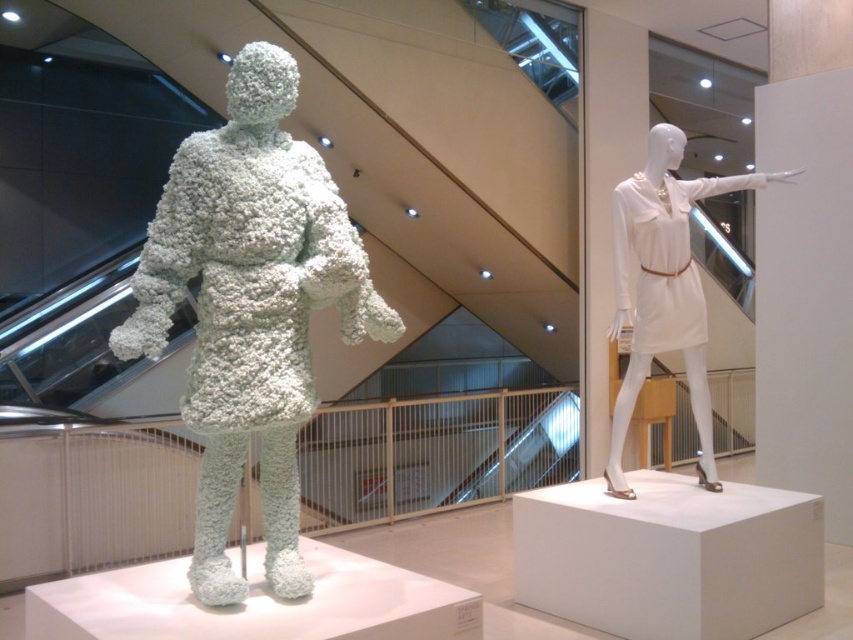
Is point (639, 358) closer to camera compared to point (508, 442)?

That is True.

Does white matte dress at right have a lesser width compared to metallic silver escalator at center?

Yes.

Is point (656, 273) positioned before point (461, 484)?

Yes, point (656, 273) is closer to viewer.

Locate an element on the screen. The height and width of the screenshot is (640, 853). white matte dress at right is located at coordinates (663, 288).

Does white fluffy sculpture at left have a smaller size compared to metallic silver escalator at center?

Indeed, white fluffy sculpture at left has a smaller size compared to metallic silver escalator at center.

Can you confirm if white fluffy sculpture at left is bigger than metallic silver escalator at center?

No.

The image size is (853, 640). What do you see at coordinates (250, 307) in the screenshot?
I see `white fluffy sculpture at left` at bounding box center [250, 307].

Where is `white fluffy sculpture at left`? This screenshot has width=853, height=640. white fluffy sculpture at left is located at coordinates (250, 307).

Is white fluffy sculpture at left above white matte dress at right?

Incorrect, white fluffy sculpture at left is not positioned above white matte dress at right.

Where is `white fluffy sculpture at left`? Image resolution: width=853 pixels, height=640 pixels. white fluffy sculpture at left is located at coordinates 250,307.